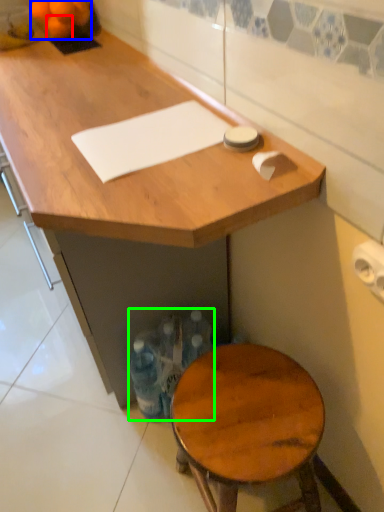
Question: Estimate the real-world distances between objects in this image. Which object is farther from tangerine (highlighted by a red box), tangerine (highlighted by a blue box) or bottle (highlighted by a green box)?

Choices:
 (A) tangerine
 (B) bottle

Answer: (B)